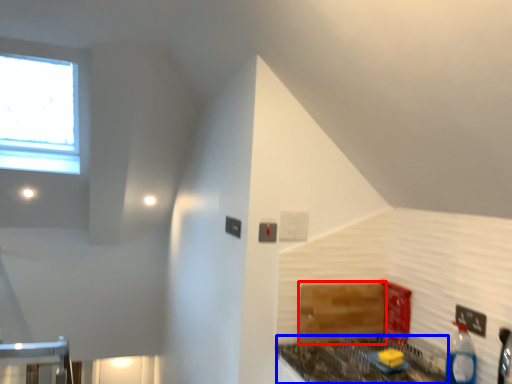
Question: Which object appears closest to the camera in this image, cabinetry (highlighted by a red box) or counter top (highlighted by a blue box)?

Choices:
 (A) cabinetry
 (B) counter top

Answer: (B)